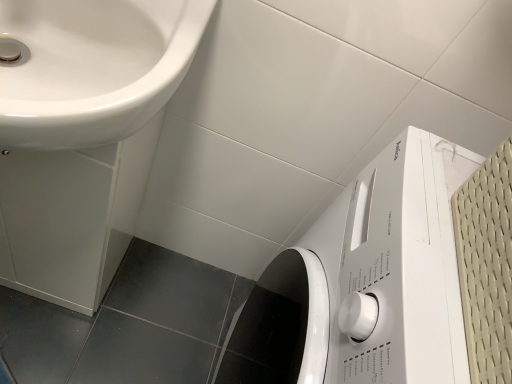
Question: Are white glossy washing machine at lower right and white glossy sink at upper left far apart?

Choices:
 (A) yes
 (B) no

Answer: (B)

Question: Is white glossy washing machine at lower right with white glossy sink at upper left?

Choices:
 (A) no
 (B) yes

Answer: (A)

Question: Is white glossy washing machine at lower right at the right side of white glossy sink at upper left?

Choices:
 (A) yes
 (B) no

Answer: (A)

Question: From the image's perspective, is white glossy washing machine at lower right beneath white glossy sink at upper left?

Choices:
 (A) yes
 (B) no

Answer: (A)

Question: Could you tell me if white glossy washing machine at lower right is turned towards white glossy sink at upper left?

Choices:
 (A) no
 (B) yes

Answer: (B)

Question: Considering the relative sizes of white glossy washing machine at lower right and white glossy sink at upper left in the image provided, is white glossy washing machine at lower right thinner than white glossy sink at upper left?

Choices:
 (A) no
 (B) yes

Answer: (A)

Question: From a real-world perspective, does white glossy sink at upper left stand above white glossy washing machine at lower right?

Choices:
 (A) no
 (B) yes

Answer: (A)

Question: Is white glossy sink at upper left taller than white glossy washing machine at lower right?

Choices:
 (A) no
 (B) yes

Answer: (A)

Question: Considering the relative sizes of white glossy sink at upper left and white glossy washing machine at lower right in the image provided, is white glossy sink at upper left smaller than white glossy washing machine at lower right?

Choices:
 (A) yes
 (B) no

Answer: (A)

Question: From a real-world perspective, is white glossy sink at upper left beneath white glossy washing machine at lower right?

Choices:
 (A) no
 (B) yes

Answer: (B)

Question: Is white glossy sink at upper left closer to camera compared to white glossy washing machine at lower right?

Choices:
 (A) no
 (B) yes

Answer: (A)

Question: Is white glossy sink at upper left bigger than white glossy washing machine at lower right?

Choices:
 (A) yes
 (B) no

Answer: (B)

Question: Is white glossy washing machine at lower right taller or shorter than white glossy sink at upper left?

Choices:
 (A) tall
 (B) short

Answer: (A)